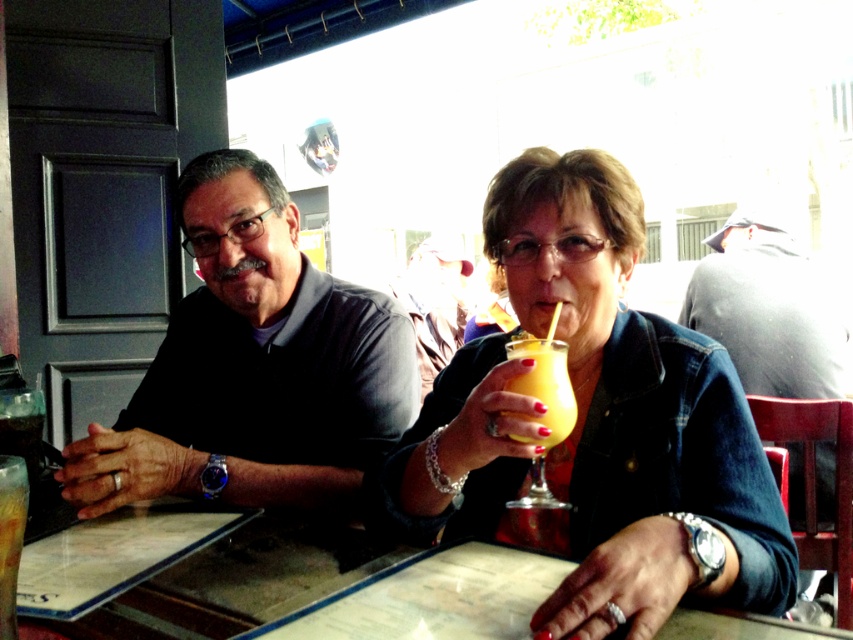
Looking at this image, can you confirm if matte orange glass at center is taller than translucent glass at table left?

Yes, matte orange glass at center is taller than translucent glass at table left.

Based on the photo, can you confirm if matte orange glass at center is thinner than translucent glass at table left?

No.

Is point (425, 472) positioned behind point (10, 472)?

Yes, it is.

At what (x,y) coordinates should I click in order to perform the action: click on matte orange glass at center. Please return your answer as a coordinate pair (x, y). The height and width of the screenshot is (640, 853). Looking at the image, I should click on (634, 413).

Does matte orange glass at center lie in front of clear glass table at center?

Yes, it is in front of clear glass table at center.

In the scene shown: Who is shorter, matte orange glass at center or clear glass table at center?

Standing shorter between the two is clear glass table at center.

Does point (483, 525) come behind point (206, 609)?

Yes, point (483, 525) is farther from viewer.

At what (x,y) coordinates should I click in order to perform the action: click on matte orange glass at center. Please return your answer as a coordinate pair (x, y). This screenshot has width=853, height=640. Looking at the image, I should click on (634, 413).

Is matte orange glass at center shorter than dark gray shirt at left?

Correct, matte orange glass at center is not as tall as dark gray shirt at left.

Does matte orange glass at center appear on the right side of dark gray shirt at left?

Yes, matte orange glass at center is to the right of dark gray shirt at left.

Does point (467, 358) come in front of point (392, 330)?

Yes, point (467, 358) is in front of point (392, 330).

Locate an element on the screen. matte orange glass at center is located at coordinates (634, 413).